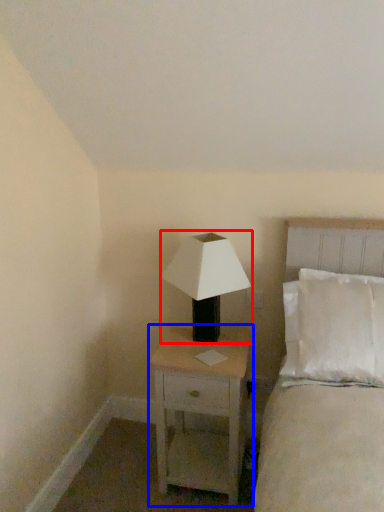
Question: Which point is further to the camera, lamp (highlighted by a red box) or nightstand (highlighted by a blue box)?

Choices:
 (A) lamp
 (B) nightstand

Answer: (B)